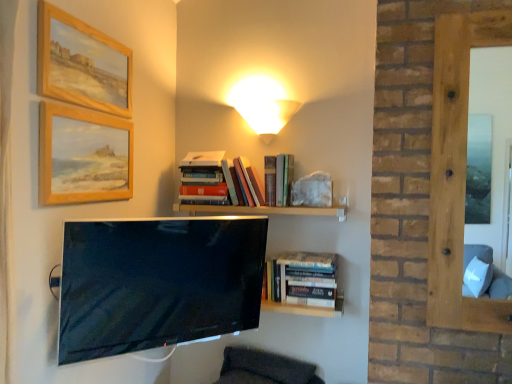
Question: Would you say hardcover books at upper center, which is the 2th book from bottom to top, is to the left or to the right of wooden painted picture frame at upper left, arranged as the 1th picture frame when ordered from the bottom, in the picture?

Choices:
 (A) right
 (B) left

Answer: (A)

Question: Which is correct: hardcover books at upper center, acting as the second book starting from the right, is inside wooden painted picture frame at upper left, the second picture frame positioned from the top, or outside of it?

Choices:
 (A) inside
 (B) outside

Answer: (B)

Question: Which is nearer to the wooden framed painting at upper left, the first picture frame in the top-to-bottom sequence?

Choices:
 (A) hardcover books at center, positioned as the 3th book in top-to-bottom order
 (B) matte black tv at center
 (C) wooden at upper center
 (D) hardcover books at center, arranged as the 1th book when viewed from the left
 (E) hardcover books at upper center, the second book positioned from the left

Answer: (D)

Question: Which object is the closest to the wooden framed painting at upper left, which is the second picture frame from bottom to top?

Choices:
 (A) matte yellow glass table lamp at upper center
 (B) wooden at upper center
 (C) smooth wooden frame at right
 (D) matte black tv at center
 (E) hardcover books at center, which is counted as the first book, starting from the right

Answer: (D)